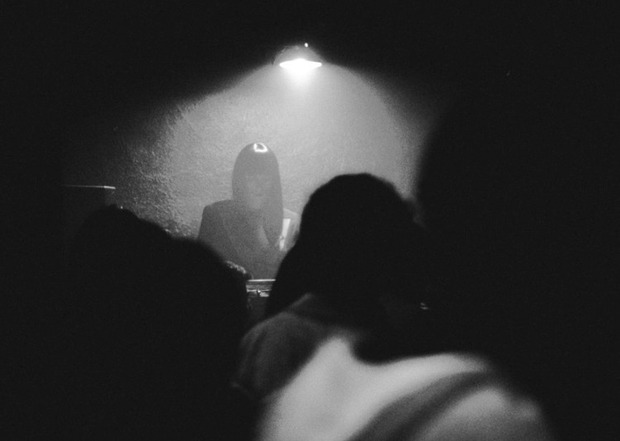
Locate an element on the screen. bright light is located at coordinates (267, 126).